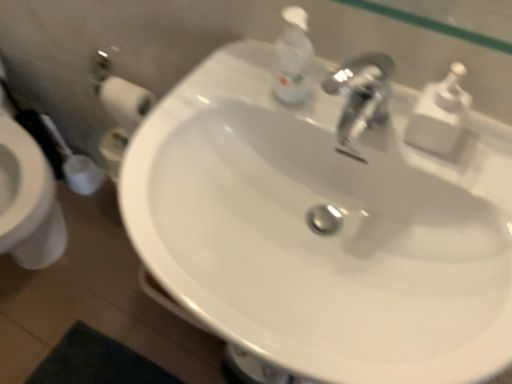
From the picture: How much space does white plastic soap dispenser at upper right, which is the 1th soap dispenser in right-to-left order, occupy vertically?

white plastic soap dispenser at upper right, which is the 1th soap dispenser in right-to-left order, is 5.48 inches in height.

You are a GUI agent. You are given a task and a screenshot of the screen. Output one action in this format:
    pyautogui.click(x=<x>, y=<y>)
    Task: Click on the white plastic soap dispenser at upper right, which is the 1th soap dispenser in right-to-left order
    
    Given the screenshot: What is the action you would take?
    pyautogui.click(x=439, y=114)

Can you confirm if white plastic soap dispenser at upper center, the first soap dispenser from the left, is positioned to the left of white plastic soap dispenser at upper right, which is the 1th soap dispenser in right-to-left order?

Indeed, white plastic soap dispenser at upper center, the first soap dispenser from the left, is positioned on the left side of white plastic soap dispenser at upper right, which is the 1th soap dispenser in right-to-left order.

Could you tell me if white plastic soap dispenser at upper center, the 2th soap dispenser in the right-to-left sequence, is turned towards white plastic soap dispenser at upper right, the second soap dispenser in the left-to-right sequence?

No, white plastic soap dispenser at upper center, the 2th soap dispenser in the right-to-left sequence, is not turned towards white plastic soap dispenser at upper right, the second soap dispenser in the left-to-right sequence.

Measure the distance between white plastic soap dispenser at upper center, the first soap dispenser from the left, and white plastic soap dispenser at upper right, which is the 1th soap dispenser in right-to-left order.

white plastic soap dispenser at upper center, the first soap dispenser from the left, and white plastic soap dispenser at upper right, which is the 1th soap dispenser in right-to-left order, are 20.62 centimeters apart from each other.

From the image's perspective, would you say white plastic soap dispenser at upper center, the 2th soap dispenser in the right-to-left sequence, is shown under white plastic soap dispenser at upper right, which is the 1th soap dispenser in right-to-left order?

Incorrect, from the image's perspective, white plastic soap dispenser at upper center, the 2th soap dispenser in the right-to-left sequence, is higher than white plastic soap dispenser at upper right, which is the 1th soap dispenser in right-to-left order.

Which is correct: white plastic soap dispenser at upper center, the 2th soap dispenser in the right-to-left sequence, is inside white glossy sink at center, or outside of it?

white plastic soap dispenser at upper center, the 2th soap dispenser in the right-to-left sequence, lies outside white glossy sink at center.

Considering the relative sizes of white plastic soap dispenser at upper center, the 2th soap dispenser in the right-to-left sequence, and white glossy sink at center in the image provided, is white plastic soap dispenser at upper center, the 2th soap dispenser in the right-to-left sequence, thinner than white glossy sink at center?

Correct, the width of white plastic soap dispenser at upper center, the 2th soap dispenser in the right-to-left sequence, is less than that of white glossy sink at center.

Does white plastic soap dispenser at upper center, the first soap dispenser from the left, turn towards white glossy sink at center?

No, white plastic soap dispenser at upper center, the first soap dispenser from the left, is not facing towards white glossy sink at center.

Consider the image. From the image's perspective, does white plastic soap dispenser at upper center, the first soap dispenser from the left, appear higher than white glossy sink at center?

Correct, white plastic soap dispenser at upper center, the first soap dispenser from the left, appears higher than white glossy sink at center in the image.

Can you tell me how much white plastic soap dispenser at upper right, the second soap dispenser in the left-to-right sequence, and white plastic soap dispenser at upper center, the 2th soap dispenser in the right-to-left sequence, differ in facing direction?

The angular difference between white plastic soap dispenser at upper right, the second soap dispenser in the left-to-right sequence, and white plastic soap dispenser at upper center, the 2th soap dispenser in the right-to-left sequence, is 0.000569 degrees.

From the picture: Is white plastic soap dispenser at upper right, the second soap dispenser in the left-to-right sequence, outside of white plastic soap dispenser at upper center, the 2th soap dispenser in the right-to-left sequence?

white plastic soap dispenser at upper right, the second soap dispenser in the left-to-right sequence, is positioned outside white plastic soap dispenser at upper center, the 2th soap dispenser in the right-to-left sequence.

Can you confirm if white plastic soap dispenser at upper right, which is the 1th soap dispenser in right-to-left order, is wider than white plastic soap dispenser at upper center, the 2th soap dispenser in the right-to-left sequence?

Yes.

From a real-world perspective, is white plastic soap dispenser at upper right, which is the 1th soap dispenser in right-to-left order, physically located above or below white plastic soap dispenser at upper center, the first soap dispenser from the left?

Clearly, from a real-world perspective, white plastic soap dispenser at upper right, which is the 1th soap dispenser in right-to-left order, is below white plastic soap dispenser at upper center, the first soap dispenser from the left.

Relative to white plastic soap dispenser at upper center, the 2th soap dispenser in the right-to-left sequence, is white glossy sink at center in front or behind?

In the image, white glossy sink at center appears in front of white plastic soap dispenser at upper center, the 2th soap dispenser in the right-to-left sequence.

Is white glossy sink at center positioned far away from white plastic soap dispenser at upper center, the 2th soap dispenser in the right-to-left sequence?

No, white glossy sink at center is not far from white plastic soap dispenser at upper center, the 2th soap dispenser in the right-to-left sequence.

Can you confirm if white glossy sink at center is thinner than white plastic soap dispenser at upper center, the first soap dispenser from the left?

Incorrect, the width of white glossy sink at center is not less than that of white plastic soap dispenser at upper center, the first soap dispenser from the left.

Consider the image. Is white plastic soap dispenser at upper center, the 2th soap dispenser in the right-to-left sequence, at the back of white glossy sink at center?

No, white glossy sink at center is not facing the opposite direction of white plastic soap dispenser at upper center, the 2th soap dispenser in the right-to-left sequence.

How different are the orientations of white plastic soap dispenser at upper right, which is the 1th soap dispenser in right-to-left order, and white glossy sink at center in degrees?

0.000693 degrees separate the facing orientations of white plastic soap dispenser at upper right, which is the 1th soap dispenser in right-to-left order, and white glossy sink at center.

Find the location of a particular element. This screenshot has width=512, height=384. sink below the white plastic soap dispenser at upper right, the second soap dispenser in the left-to-right sequence (from a real-world perspective) is located at coordinates (323, 231).

Is white plastic soap dispenser at upper right, which is the 1th soap dispenser in right-to-left order, placed right next to white glossy sink at center?

No, white plastic soap dispenser at upper right, which is the 1th soap dispenser in right-to-left order, is not next to white glossy sink at center.

The height and width of the screenshot is (384, 512). I want to click on soap dispenser that is the 1st one when counting backward from the white glossy sink at center, so click(x=439, y=114).

Is white glossy sink at center placed right next to white plastic soap dispenser at upper right, which is the 1th soap dispenser in right-to-left order?

white glossy sink at center and white plastic soap dispenser at upper right, which is the 1th soap dispenser in right-to-left order, are not in contact.

Based on their positions, is white glossy sink at center located to the left or right of white plastic soap dispenser at upper right, the second soap dispenser in the left-to-right sequence?

Based on their positions, white glossy sink at center is located to the left of white plastic soap dispenser at upper right, the second soap dispenser in the left-to-right sequence.

From a real-world perspective, is white glossy sink at center on top of white plastic soap dispenser at upper right, which is the 1th soap dispenser in right-to-left order?

No, from a real-world perspective, white glossy sink at center is not above white plastic soap dispenser at upper right, which is the 1th soap dispenser in right-to-left order.

Locate an element on the screen. The height and width of the screenshot is (384, 512). soap dispenser lying on the left of white plastic soap dispenser at upper right, which is the 1th soap dispenser in right-to-left order is located at coordinates pyautogui.click(x=293, y=57).

The width and height of the screenshot is (512, 384). In order to click on sink below the white plastic soap dispenser at upper center, the first soap dispenser from the left (from a real-world perspective) in this screenshot , I will do `click(323, 231)`.

Considering their positions, is white glossy sink at center positioned closer to white plastic soap dispenser at upper center, the 2th soap dispenser in the right-to-left sequence, than white plastic soap dispenser at upper right, the second soap dispenser in the left-to-right sequence?

Among the two, white plastic soap dispenser at upper right, the second soap dispenser in the left-to-right sequence, is located nearer to white plastic soap dispenser at upper center, the 2th soap dispenser in the right-to-left sequence.

From the image, which object appears to be nearer to white glossy sink at center, white plastic soap dispenser at upper right, the second soap dispenser in the left-to-right sequence, or white plastic soap dispenser at upper center, the 2th soap dispenser in the right-to-left sequence?

Among the two, white plastic soap dispenser at upper center, the 2th soap dispenser in the right-to-left sequence, is located nearer to white glossy sink at center.

Considering their positions, is white plastic soap dispenser at upper center, the 2th soap dispenser in the right-to-left sequence, positioned further to white glossy sink at center than white plastic soap dispenser at upper right, which is the 1th soap dispenser in right-to-left order?

white plastic soap dispenser at upper right, which is the 1th soap dispenser in right-to-left order.

Estimate the real-world distances between objects in this image. Which object is further from white plastic soap dispenser at upper right, which is the 1th soap dispenser in right-to-left order, white glossy sink at center or white plastic soap dispenser at upper center, the 2th soap dispenser in the right-to-left sequence?

Based on the image, white glossy sink at center appears to be further to white plastic soap dispenser at upper right, which is the 1th soap dispenser in right-to-left order.

Based on their spatial positions, is white plastic soap dispenser at upper right, which is the 1th soap dispenser in right-to-left order, or white glossy sink at center closer to white plastic soap dispenser at upper center, the first soap dispenser from the left?

Among the two, white plastic soap dispenser at upper right, which is the 1th soap dispenser in right-to-left order, is located nearer to white plastic soap dispenser at upper center, the first soap dispenser from the left.

Estimate the real-world distances between objects in this image. Which object is closer to white plastic soap dispenser at upper right, the second soap dispenser in the left-to-right sequence, white plastic soap dispenser at upper center, the 2th soap dispenser in the right-to-left sequence, or white glossy sink at center?

white plastic soap dispenser at upper center, the 2th soap dispenser in the right-to-left sequence, is positioned closer to the anchor white plastic soap dispenser at upper right, the second soap dispenser in the left-to-right sequence.

Locate an element on the screen. soap dispenser between white plastic soap dispenser at upper center, the 2th soap dispenser in the right-to-left sequence, and white glossy sink at center in the up-down direction is located at coordinates (439, 114).